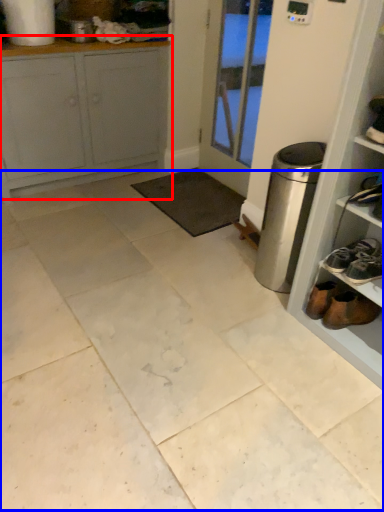
Question: Which point is closer to the camera, cabinetry (highlighted by a red box) or ceramic tile (highlighted by a blue box)?

Choices:
 (A) cabinetry
 (B) ceramic tile

Answer: (B)